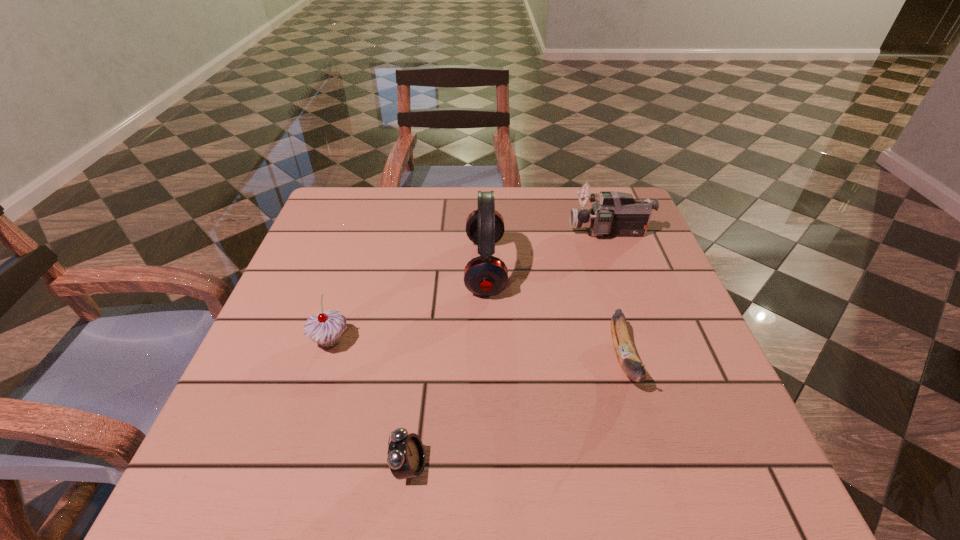
Where is `camcorder that is at the right edge`? The image size is (960, 540). camcorder that is at the right edge is located at coordinates (614, 214).

Locate an element on the screen. banana that is at the right edge is located at coordinates (629, 361).

Identify the location of object positioned at the far right corner. (614, 214).

Locate an element on the screen. free space at the far edge of the desktop is located at coordinates (472, 203).

In the image, there is a desktop. Where is `vacant region at the near edge`? vacant region at the near edge is located at coordinates (476, 449).

In the image, there is a desktop. What are the coordinates of `free region at the left edge` in the screenshot? It's located at (324, 355).

Identify the location of vacant space at the right edge. (676, 429).

Where is `vacant space that is in between the leftmost object and the banana`? This screenshot has width=960, height=540. vacant space that is in between the leftmost object and the banana is located at coordinates tap(477, 349).

This screenshot has height=540, width=960. I want to click on free spot between the banana and the cupcake, so [x=477, y=349].

Image resolution: width=960 pixels, height=540 pixels. I want to click on free spot between the banana and the camcorder, so click(616, 295).